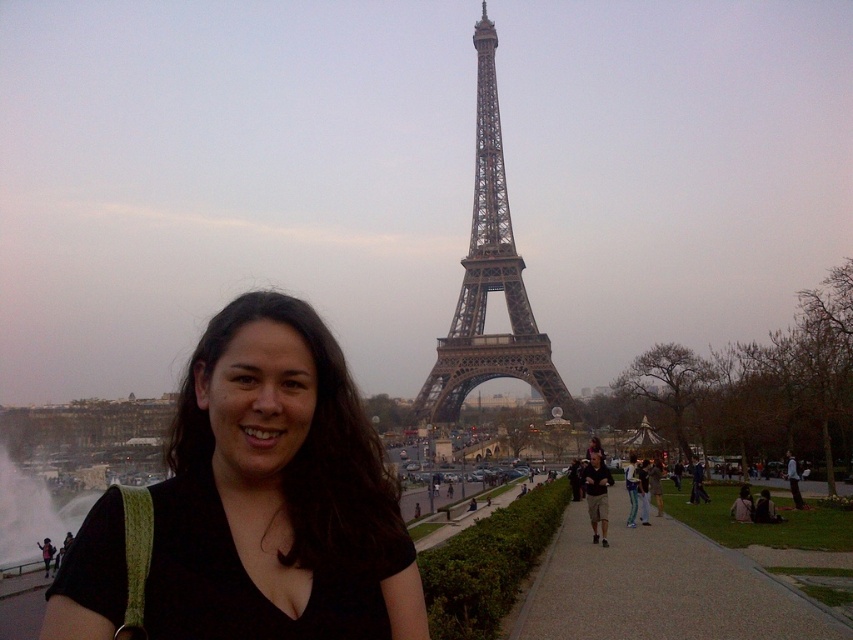
You are a photographer trying to capture the Eiffel Tower and the woman in the same frame. Given the scene described, can you fit both the metallic brown eiffel tower at center and the matte black shirt at center in your camera frame without moving the camera? Explain why or why not.

Yes, the metallic brown eiffel tower at center is much taller than the matte black shirt at center, so they can both be captured in the same frame as the tower occupies more vertical space while the shirt is smaller and positioned lower.

You are a photographer standing at the Eiffel Tower. You want to take a photo that includes both the black matte shirt at center and the metallic brown eiffel tower at center. Given that the distance between them is 42.19 meters, what is the minimum focal length required to capture both subjects in the same frame?

The minimum focal length required to capture both the black matte shirt at center and the metallic brown eiffel tower at center in the same frame would depend on the sensor size of the camera and the desired field of view. However, since the distance between them is 42.19 meters, a wide angle lens with a focal length of around 24mm to 35mm would likely be sufficient to include both subjects in the frame.

You are a photographer standing at the Eiffel Tower. You notice two black shirts in the scene. One is labeled as the black matte shirt at center and the other as the matte black shirt at center. Which one is closer to you?

The black matte shirt at center is closer to you since it is only 65.71 meters away from the matte black shirt at center, implying it is nearer.